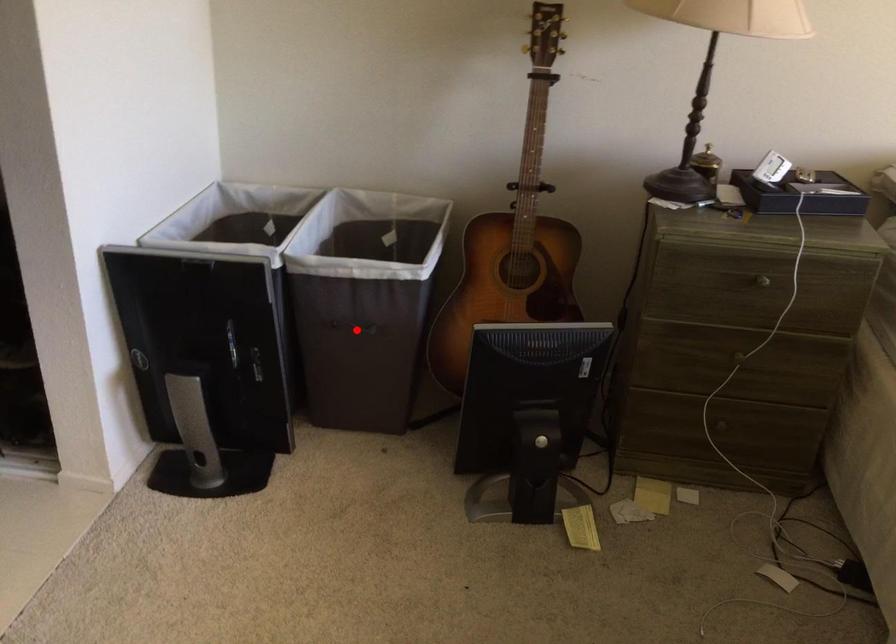
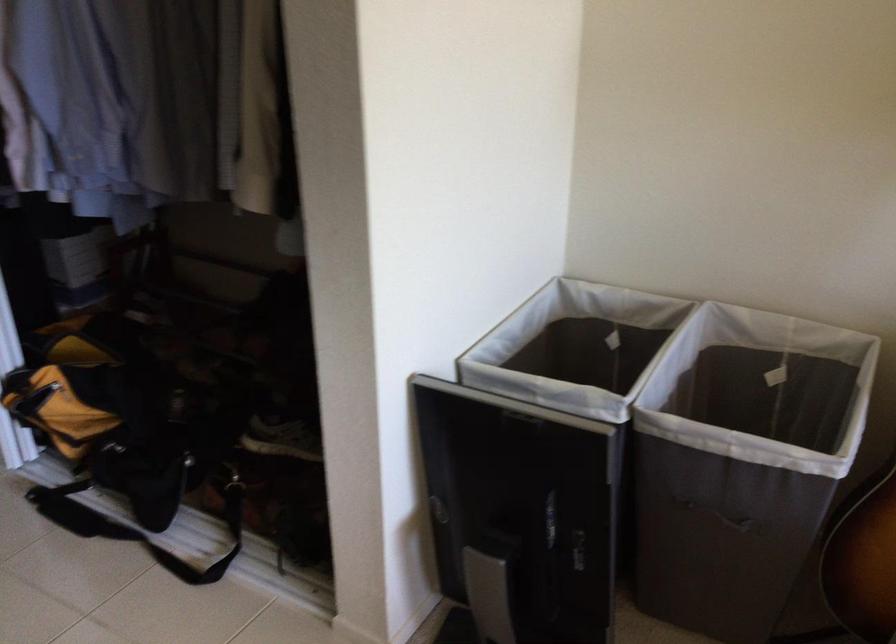
The point at the highlighted location is marked in the first image. Where is the corresponding point in the second image?

(719, 516)